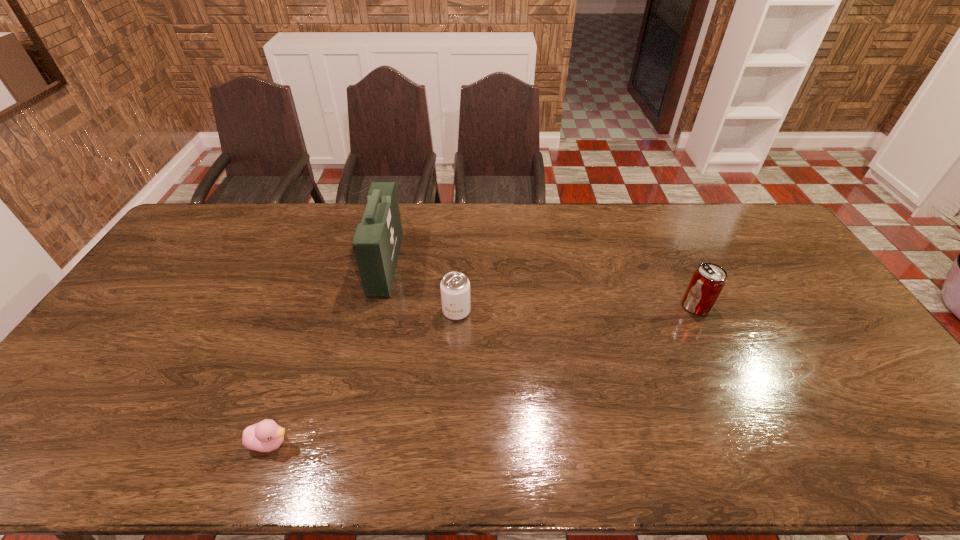
I want to click on blank region between the nearest object and the left soda can, so click(x=364, y=377).

Locate an element on the screen. This screenshot has height=540, width=960. free space between the third object from left to right and the second object from left to right is located at coordinates click(x=421, y=287).

Find the location of a particular element. vacant area that lies between the third object from right to left and the leftmost object is located at coordinates (328, 353).

I want to click on unoccupied area between the first-aid kit and the rightmost object, so click(x=540, y=285).

I want to click on free space between the left soda can and the first-aid kit, so click(421, 287).

This screenshot has width=960, height=540. Find the location of `unoccupied area between the left soda can and the right soda can`. unoccupied area between the left soda can and the right soda can is located at coordinates (576, 309).

Where is `the second closest object to the rightmost object`? The image size is (960, 540). the second closest object to the rightmost object is located at coordinates (377, 240).

Find the location of a particular element. The height and width of the screenshot is (540, 960). object that stands as the second closest to the third object from right to left is located at coordinates (265, 436).

This screenshot has width=960, height=540. What are the coordinates of `vacant space that satisfies the following two spatial constraints: 1. on the front-facing side of the second object from left to right; 2. on the right side of the left soda can` in the screenshot? It's located at (374, 311).

You are a GUI agent. You are given a task and a screenshot of the screen. Output one action in this format:
    pyautogui.click(x=<x>, y=<y>)
    Task: Click on the vacant position in the image that satisfies the following two spatial constraints: 1. on the front-facing side of the first-aid kit; 2. on the left side of the second object from right to left
    Image resolution: width=960 pixels, height=540 pixels.
    Given the screenshot: What is the action you would take?
    pyautogui.click(x=374, y=311)